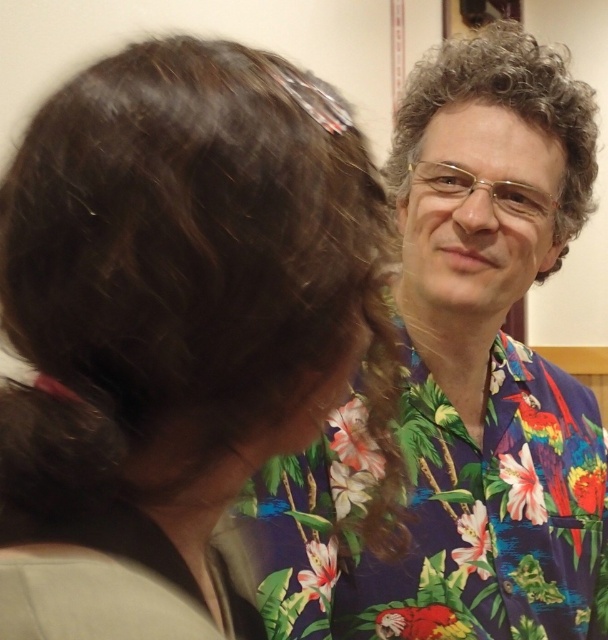
Question: Does dark brown hair at upper left lie in front of curly brown hair at upper right?

Choices:
 (A) no
 (B) yes

Answer: (B)

Question: Does dark brown hair at upper left have a larger size compared to curly brown hair at upper right?

Choices:
 (A) yes
 (B) no

Answer: (B)

Question: Which of the following is the farthest from the observer?

Choices:
 (A) (562, 76)
 (B) (71, 228)

Answer: (A)

Question: Does dark brown hair at upper left come in front of floral shirt at upper right?

Choices:
 (A) no
 (B) yes

Answer: (B)

Question: Which of the following is the farthest from the observer?

Choices:
 (A) floral shirt at upper right
 (B) dark brown hair at upper left
 (C) curly brown hair at upper right

Answer: (C)

Question: Which point appears farthest from the camera in this image?

Choices:
 (A) (558, 609)
 (B) (108, 488)
 (C) (485, 86)

Answer: (A)